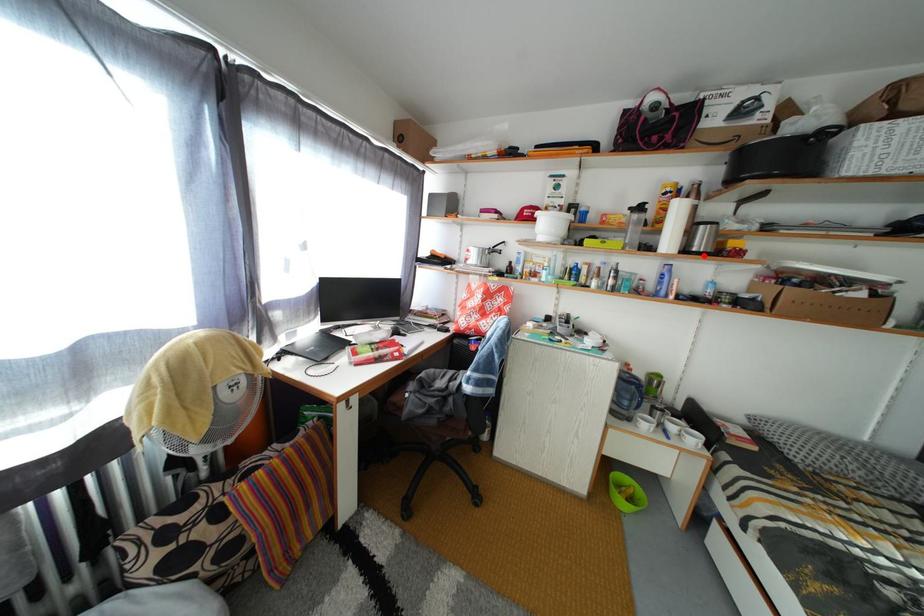
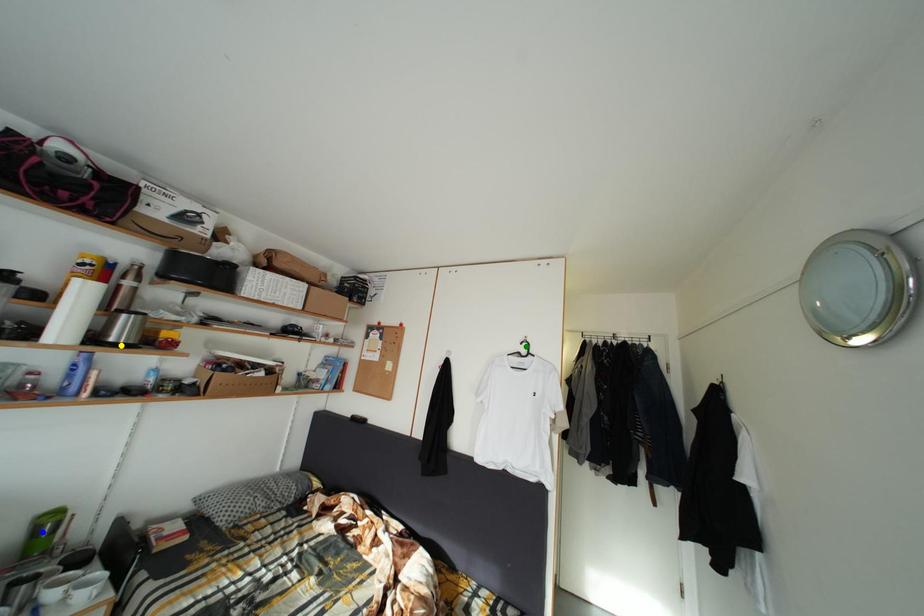
Question: I am providing you with two images of the same scene from different viewpoints. A red point is marked on the first image. You are given multiple points on the second image. Which mark in image 2 goes with the point in image 1?

Choices:
 (A) blue point
 (B) green point
 (C) yellow point

Answer: (C)